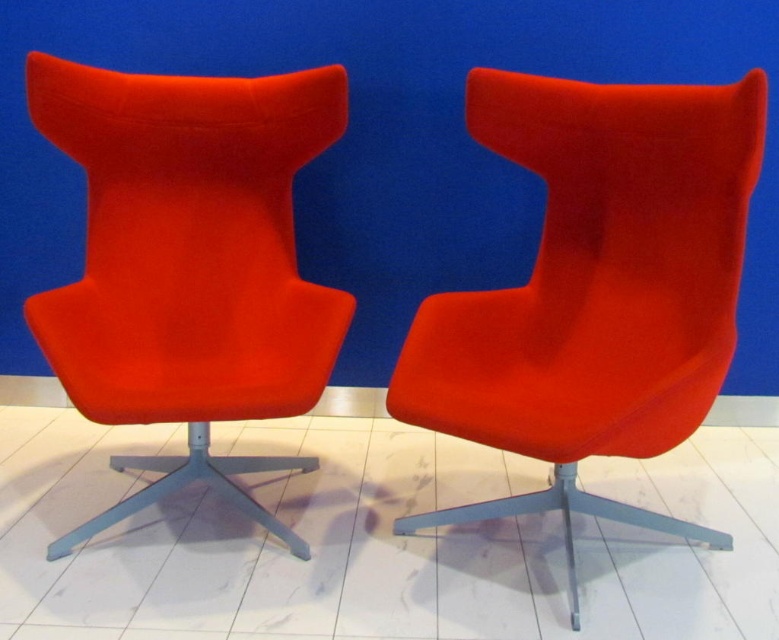
You are an interior designer arranging furniture in a room with the given scene. You need to place a new rectangular coffee table between the two red chairs. Which chair should the coffee table be placed closer to, the matte red armchair at center or the matte red fabric swivel chair at left, based on their positions?

The coffee table should be placed closer to the matte red armchair at center because it is positioned below the matte red fabric swivel chair at left, indicating it is lower and likely closer to the floor where the table would rest.

You are a delivery person trying to place a large box between the two chairs. The box is 50 centimeters wide. Can you fit it between the matte red armchair at center and the matte red fabric swivel chair at left?

The distance between the matte red armchair at center and the matte red fabric swivel chair at left is 50.20 centimeters. Since the box is 50 centimeters wide, it can fit between them with a small gap of 0.20 centimeters remaining.

You are standing at the origin point of the coordinate system in the room. The coordinate system has its origin at the bottom left corner of the room. The x and y axes are aligned with the walls. You want to place a new chair exactly 0.2 units to the right of the matte red armchair at center. What are the coordinates of the new chair?

The coordinates of the new chair would be calculated by adding 0.2 to the x coordinate of the matte red armchair at center. The original coordinates are at point (x=594, y=289). Adding 0.2 to the x value gives 0.453 plus 0.2 equals 0.653. The y coordinate remains 0.765. Therefore, the new chair should be placed at coordinates (x=594, y=417).